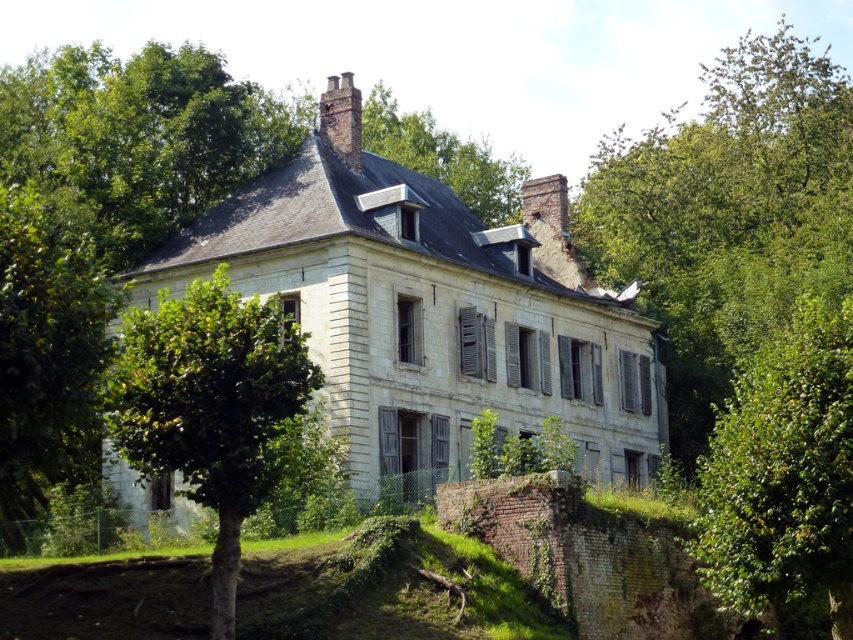
Is green leafy tree at right taller than green leafy tree at center?

Correct, green leafy tree at right is much taller as green leafy tree at center.

Can you confirm if green leafy tree at right is smaller than green leafy tree at center?

No, green leafy tree at right is not smaller than green leafy tree at center.

Does point (734, 460) come closer to viewer compared to point (206, 497)?

No, it is not.

Find the location of `green leafy tree at right`. green leafy tree at right is located at coordinates (784, 474).

Does white stone mansion at center appear on the left side of green leafy tree at right?

Indeed, white stone mansion at center is positioned on the left side of green leafy tree at right.

Which is more to the right, white stone mansion at center or green leafy tree at right?

green leafy tree at right

The image size is (853, 640). Identify the location of white stone mansion at center. (432, 316).

Is green leafy tree at center bigger than brick chimney at upper center?

Yes, green leafy tree at center is bigger than brick chimney at upper center.

The height and width of the screenshot is (640, 853). Identify the location of green leafy tree at center. click(210, 406).

Is point (241, 419) closer to camera compared to point (349, 138)?

Yes, point (241, 419) is closer to viewer.

I want to click on green leafy tree at center, so (x=210, y=406).